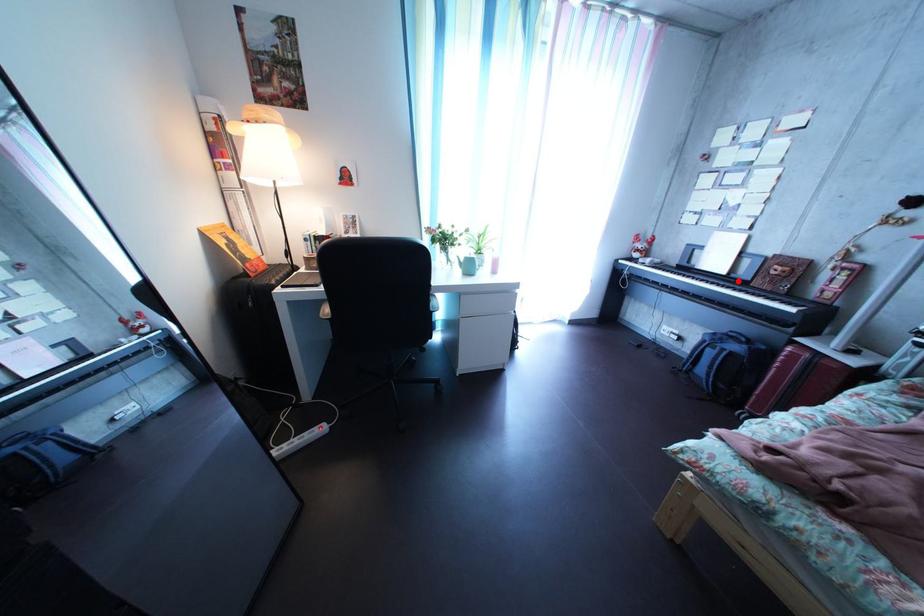
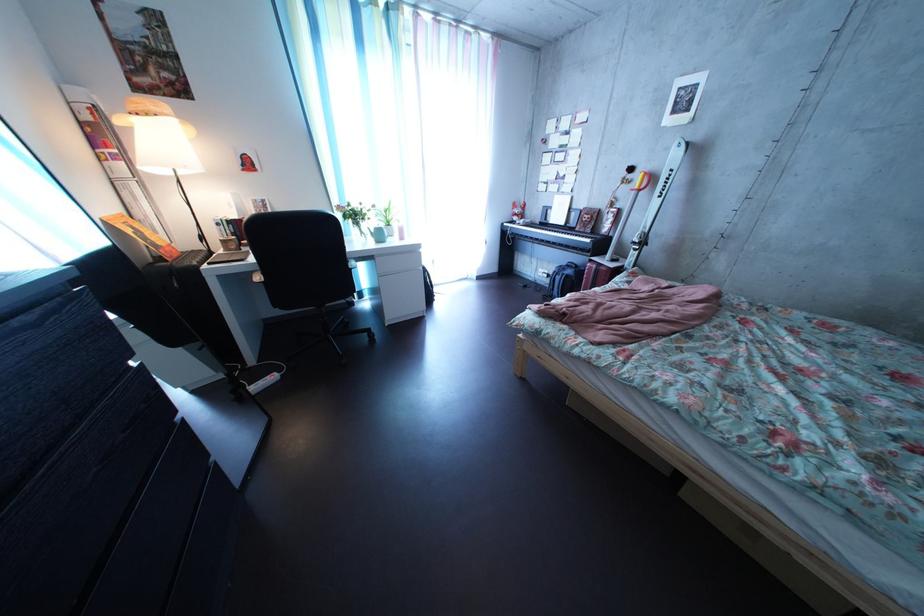
Question: A red point is marked in image1. In image2, is the corresponding 3D point closer to the camera or farther? Reply with the corresponding letter.

Choices:
 (A) The corresponding 3D point is closer.
 (B) The corresponding 3D point is farther.

Answer: (A)